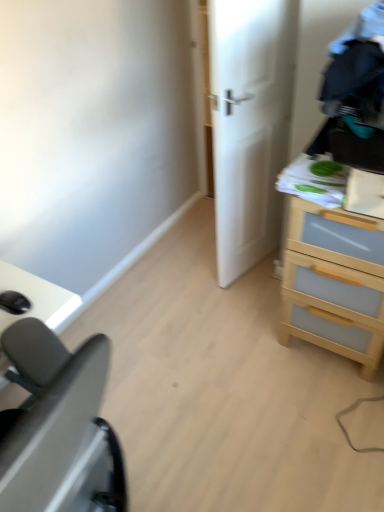
Question: From their relative heights in the image, would you say white matte door at center is taller or shorter than light wood chest of drawers at right?

Choices:
 (A) short
 (B) tall

Answer: (B)

Question: Is white matte door at center bigger or smaller than light wood chest of drawers at right?

Choices:
 (A) big
 (B) small

Answer: (B)

Question: Considering the real-world distances, which object is closest to the light wood chest of drawers at right?

Choices:
 (A) white matte door at center
 (B) black matte desk at lower left

Answer: (A)

Question: Based on their relative distances, which object is farther from the white matte door at center?

Choices:
 (A) light wood chest of drawers at right
 (B) black matte desk at lower left

Answer: (B)